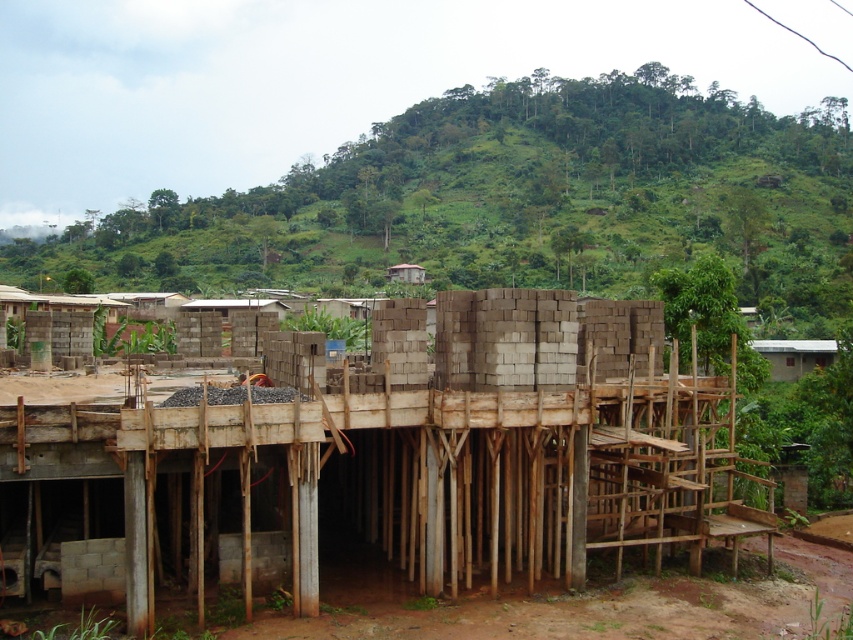
Can you confirm if gray concrete blocks at center is positioned to the left of gray concrete foundation at lower left?

No, gray concrete blocks at center is not to the left of gray concrete foundation at lower left.

Where is `gray concrete blocks at center`? The height and width of the screenshot is (640, 853). gray concrete blocks at center is located at coordinates (372, 481).